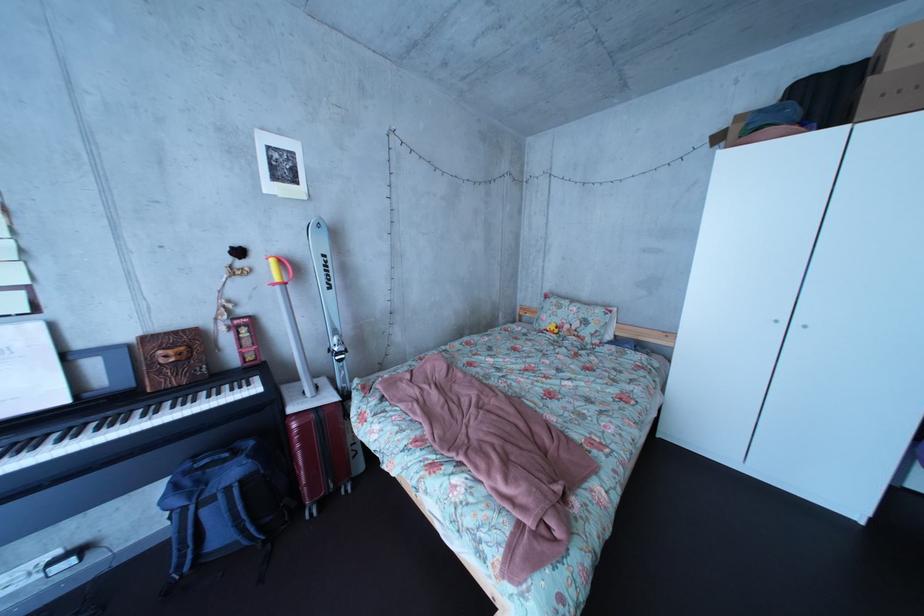
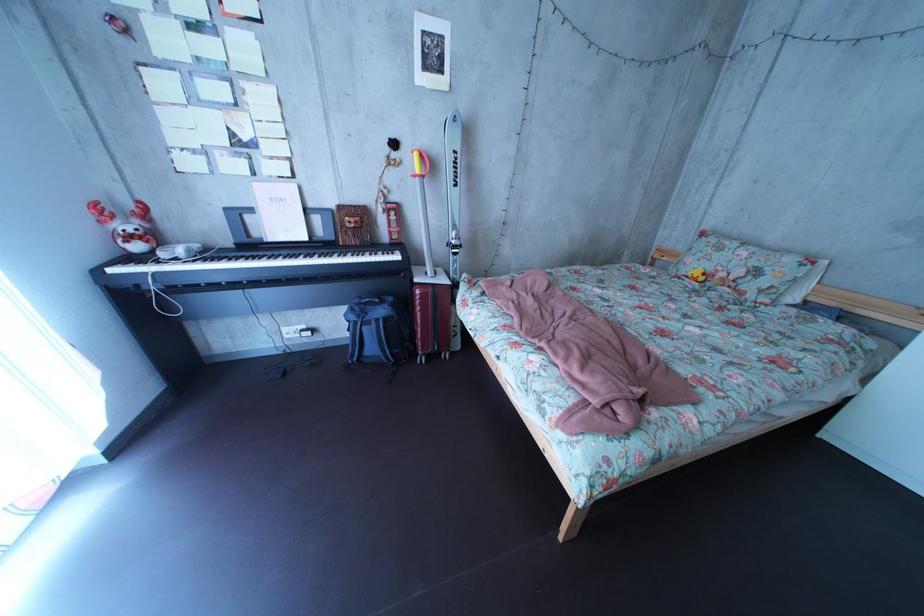
The point at [186,360] is marked in the first image. Where is the corresponding point in the second image?

(367, 228)